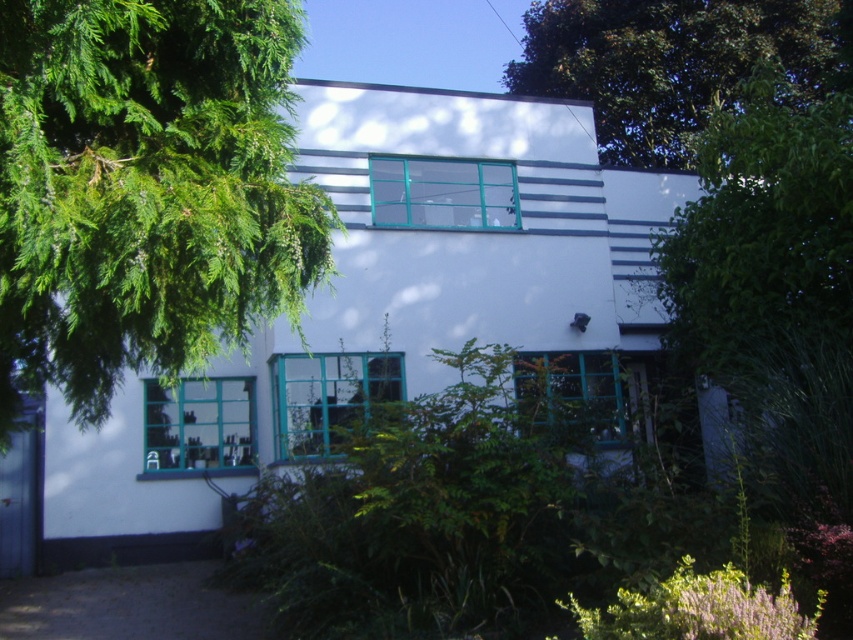
Looking at this image, you are a landscape architect designing a walking path between the green leafy tree at right and the green leafy tree at upper center. The path must be straight and 1 meter wide. Is there enough space between the two trees to accommodate this path?

The distance between the green leafy tree at right and the green leafy tree at upper center is 10.57 meters. Since the path only needs to be 1 meter wide, there is more than enough space to create a straight path between them.

You are an architect designing a new garden layout. You have two green leafy trees to place in the design. The trees are labeled as the green leafy tree at right and the green leafy tree at upper center. Which tree should you place closer to the building to ensure it doesn not block the view of the teal framed windows?

The green leafy tree at right is smaller than the green leafy tree at upper center, so placing the smaller green leafy tree at right closer to the building would prevent it from blocking the view of the teal framed windows.